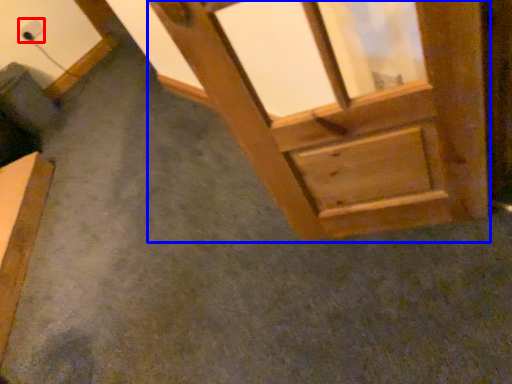
Question: Which point is further to the camera, electric outlet (highlighted by a red box) or window frame (highlighted by a blue box)?

Choices:
 (A) electric outlet
 (B) window frame

Answer: (A)